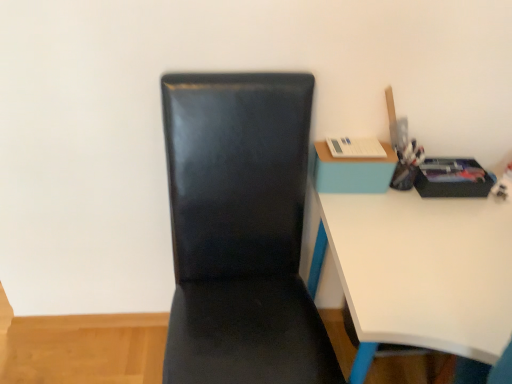
The width and height of the screenshot is (512, 384). In order to click on free location in front of blue matte table at upper right in this screenshot , I will do `click(366, 221)`.